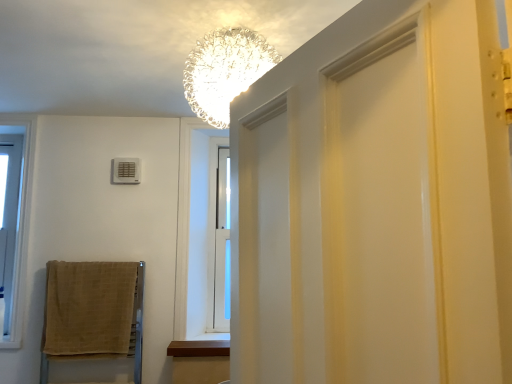
Question: Does point (52, 269) appear closer or farther from the camera than point (3, 233)?

Choices:
 (A) closer
 (B) farther

Answer: (A)

Question: Is beige woven towel at lower left to the left or to the right of clear glass window at left in the image?

Choices:
 (A) left
 (B) right

Answer: (B)

Question: Estimate the real-world distances between objects in this image. Which object is closer to the white plastic air conditioner at upper left?

Choices:
 (A) clear glass chandelier at upper center
 (B) brown wood at lower center
 (C) clear glass window at left
 (D) beige woven towel at lower left

Answer: (C)

Question: Estimate the real-world distances between objects in this image. Which object is farther from the brown wood at lower center?

Choices:
 (A) clear glass window at left
 (B) clear glass chandelier at upper center
 (C) beige woven towel at lower left
 (D) white plastic air conditioner at upper left

Answer: (B)